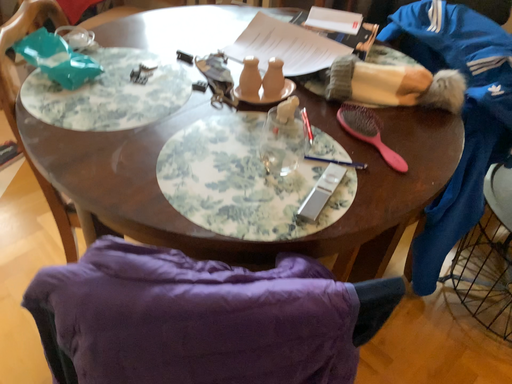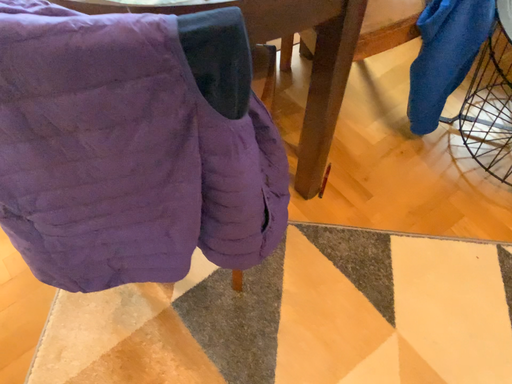
Question: Which way did the camera rotate in the video?

Choices:
 (A) rotated downward
 (B) rotated upward

Answer: (A)